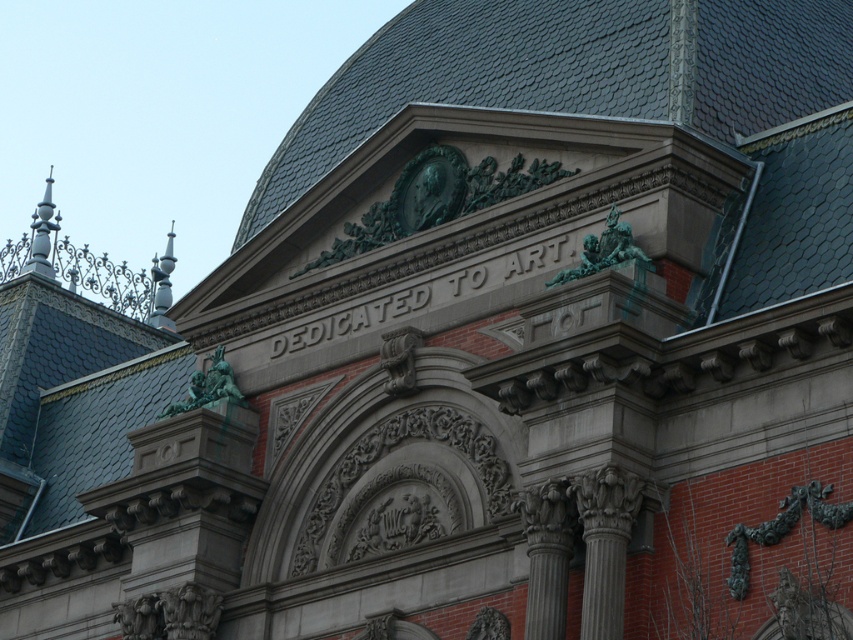
Image resolution: width=853 pixels, height=640 pixels. I want to click on green patina bust at center, so click(428, 189).

Which is in front, point (428, 205) or point (41, 200)?

Point (428, 205)

The width and height of the screenshot is (853, 640). Identify the location of green patina bust at center. (428, 189).

Locate an element on the screen. This screenshot has height=640, width=853. green patina bust at center is located at coordinates (428, 189).

Is point (566, 566) less distant than point (164, 292)?

Yes, it is in front of point (164, 292).

Is gray stone column at center to the right of white glossy spire at upper left from the viewer's perspective?

Yes, gray stone column at center is to the right of white glossy spire at upper left.

The image size is (853, 640). Describe the element at coordinates (546, 556) in the screenshot. I see `gray stone column at center` at that location.

Where is `gray stone column at center`? gray stone column at center is located at coordinates (546, 556).

Is point (527, 632) more distant than point (35, 237)?

No, (527, 632) is closer to viewer.

Is gray stone column at center smaller than polished silver spire at upper left?

Yes.

Image resolution: width=853 pixels, height=640 pixels. Find the location of `gray stone column at center`. gray stone column at center is located at coordinates (546, 556).

The width and height of the screenshot is (853, 640). I want to click on gray stone column at center, so click(x=546, y=556).